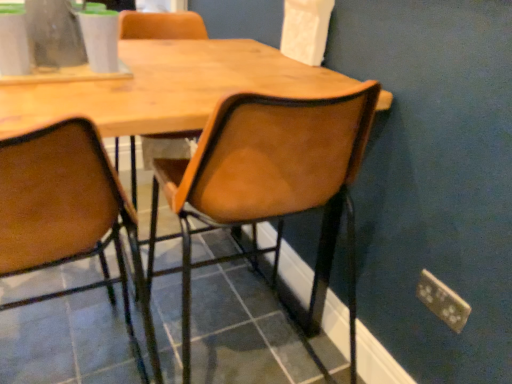
Question: Could metallic gold power plugs and sockets at lower right be considered to be inside leather-like brown chair at center, the second chair viewed from the left?

Choices:
 (A) yes
 (B) no

Answer: (B)

Question: From the image's perspective, is leather-like brown chair at center, the second chair viewed from the left, over metallic gold power plugs and sockets at lower right?

Choices:
 (A) yes
 (B) no

Answer: (A)

Question: Can we say leather-like brown chair at center, the second chair viewed from the left, lies outside metallic gold power plugs and sockets at lower right?

Choices:
 (A) no
 (B) yes

Answer: (B)

Question: Does leather-like brown chair at center, the second chair viewed from the left, have a greater height compared to metallic gold power plugs and sockets at lower right?

Choices:
 (A) yes
 (B) no

Answer: (A)

Question: Does leather-like brown chair at center, the second chair viewed from the left, appear on the left side of metallic gold power plugs and sockets at lower right?

Choices:
 (A) yes
 (B) no

Answer: (A)

Question: Can you see leather-like brown chair at center, which is the 1th chair in right-to-left order, touching metallic gold power plugs and sockets at lower right?

Choices:
 (A) yes
 (B) no

Answer: (B)

Question: Does clear glass vase at upper left lie behind metallic gold power plugs and sockets at lower right?

Choices:
 (A) yes
 (B) no

Answer: (B)

Question: Can you confirm if clear glass vase at upper left is shorter than metallic gold power plugs and sockets at lower right?

Choices:
 (A) no
 (B) yes

Answer: (A)

Question: Is clear glass vase at upper left facing towards metallic gold power plugs and sockets at lower right?

Choices:
 (A) yes
 (B) no

Answer: (B)

Question: Does clear glass vase at upper left have a smaller size compared to metallic gold power plugs and sockets at lower right?

Choices:
 (A) yes
 (B) no

Answer: (B)

Question: Considering the relative sizes of clear glass vase at upper left and metallic gold power plugs and sockets at lower right in the image provided, is clear glass vase at upper left bigger than metallic gold power plugs and sockets at lower right?

Choices:
 (A) no
 (B) yes

Answer: (B)

Question: Does clear glass vase at upper left have a greater height compared to metallic gold power plugs and sockets at lower right?

Choices:
 (A) no
 (B) yes

Answer: (B)

Question: Is brown leather chair at center, the second chair positioned from the right, smaller than leather-like brown chair at center, which is the 1th chair in right-to-left order?

Choices:
 (A) no
 (B) yes

Answer: (B)